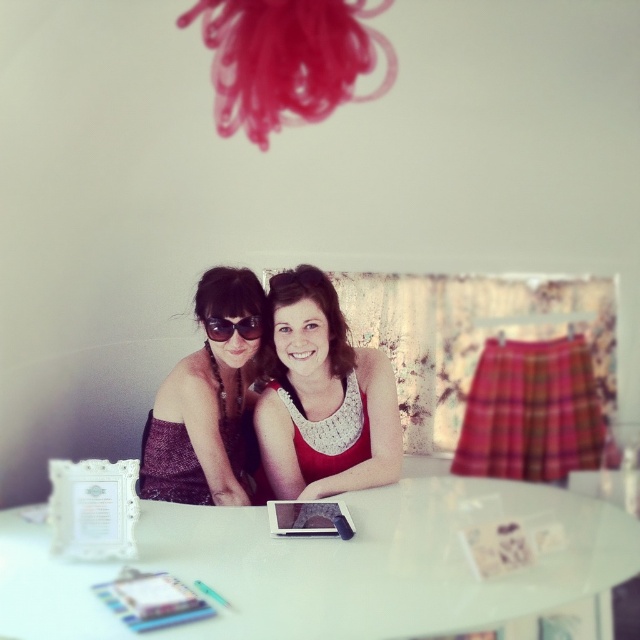
Question: Can you confirm if white glossy round table at center is positioned to the left of matte black dress at center?

Choices:
 (A) no
 (B) yes

Answer: (A)

Question: Which point is closer to the camera taking this photo?

Choices:
 (A) (157, 444)
 (B) (273, 618)
 (C) (237, 321)
 (D) (266, 499)

Answer: (B)

Question: Can you confirm if white lace tank top at center is wider than matte black dress at center?

Choices:
 (A) no
 (B) yes

Answer: (B)

Question: Among these points, which one is nearest to the camera?

Choices:
 (A) (259, 321)
 (B) (323, 566)
 (C) (172, 401)
 (D) (268, 488)

Answer: (B)

Question: Can you confirm if white lace tank top at center is positioned below matte black sunglasses at center?

Choices:
 (A) yes
 (B) no

Answer: (A)

Question: Which point is farther from the camera taking this photo?

Choices:
 (A) (204, 496)
 (B) (314, 547)
 (C) (314, 296)
 (D) (216, 326)

Answer: (A)